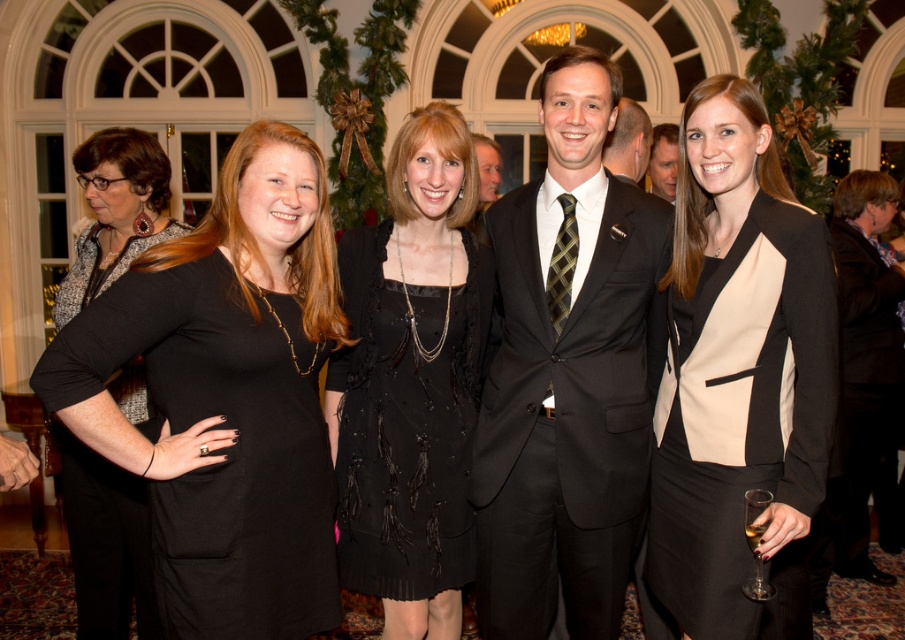
You are a photographer at the event and need to focus on the black dress at center. According to the coordinates provided, where should you aim your camera lens?

The black dress at center is located at coordinates point (226, 396), so aim the camera lens there.

You are a photographer adjusting your camera settings to focus on the black satin dress at center and the brown textured tie at center. Which one should you focus on first to ensure proper depth of field?

You should focus on the black satin dress at center first because it is closer to the viewer than the brown textured tie at center, allowing for better depth of field adjustment.

You are standing in the room and want to find the black satin dress at center. Based on the coordinates provided, where should you look relative to the other people in the image?

The black satin dress at center is located at coordinates point (411, 381), which places it at the center of the image. Since it is labeled as being at the center, you should look towards the middle of the group where the main focus is likely positioned.